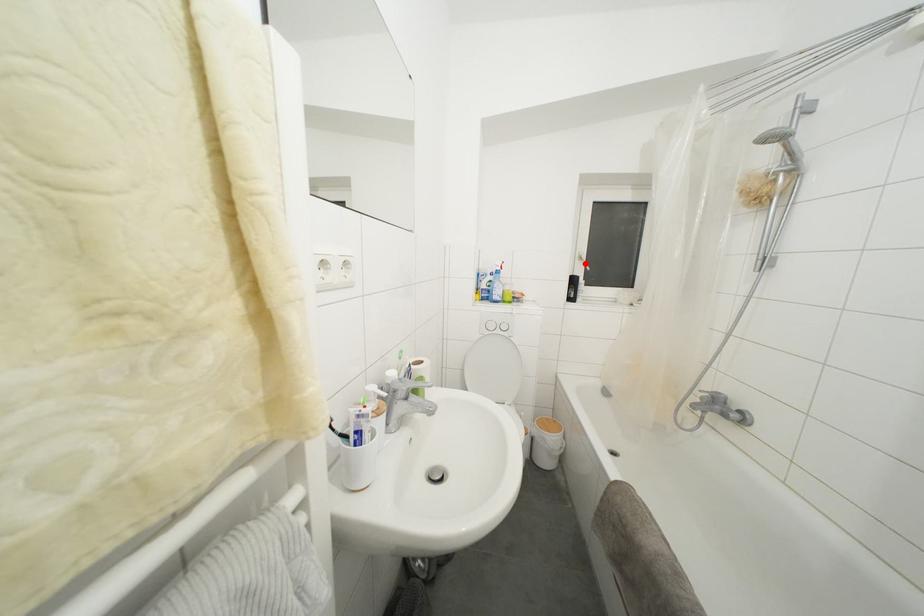
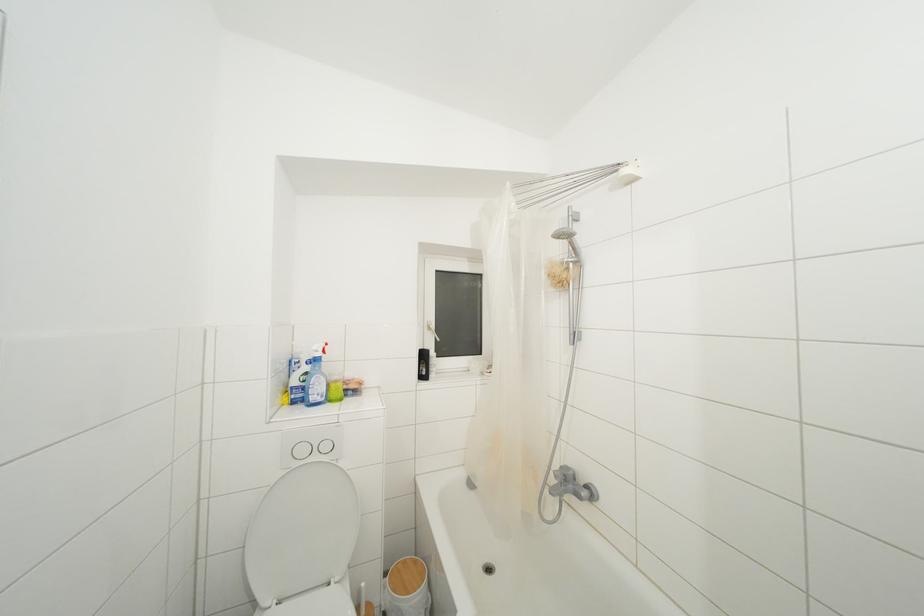
Locate, in the second image, the point that corresponds to the highlighted location in the first image.

(433, 333)